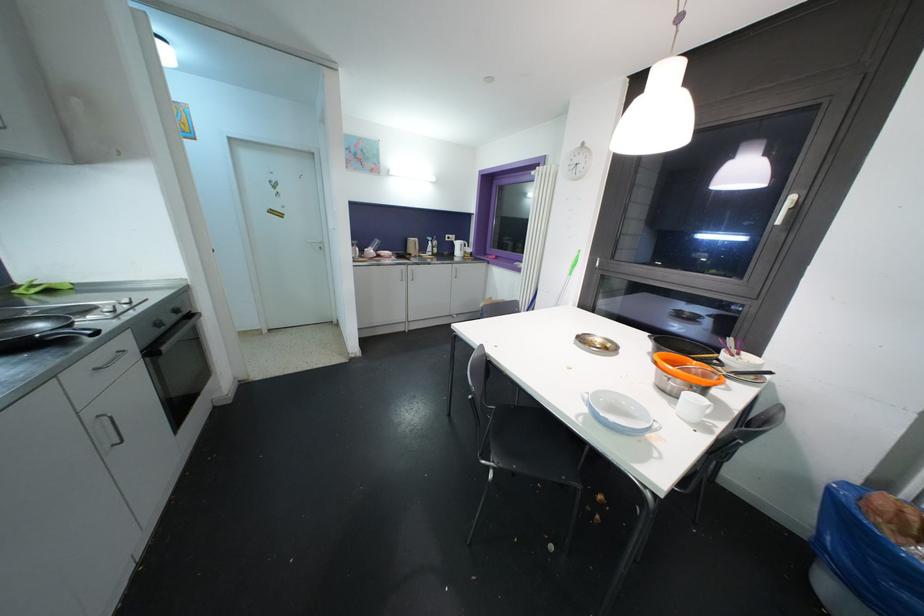
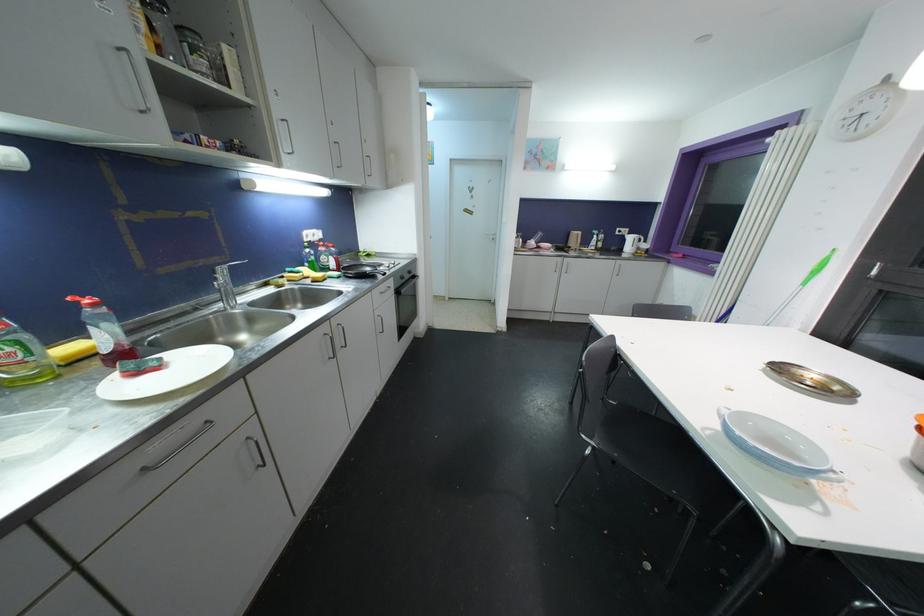
The point at (460, 246) is marked in the first image. Where is the corresponding point in the second image?

(634, 241)